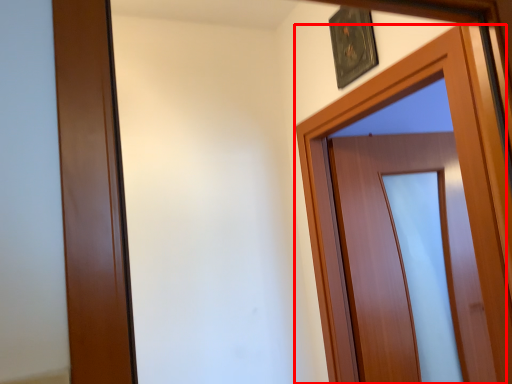
Question: From the image, what is the correct spatial relationship of door (annotated by the red box) in relation to picture frame?

Choices:
 (A) left
 (B) right

Answer: (B)